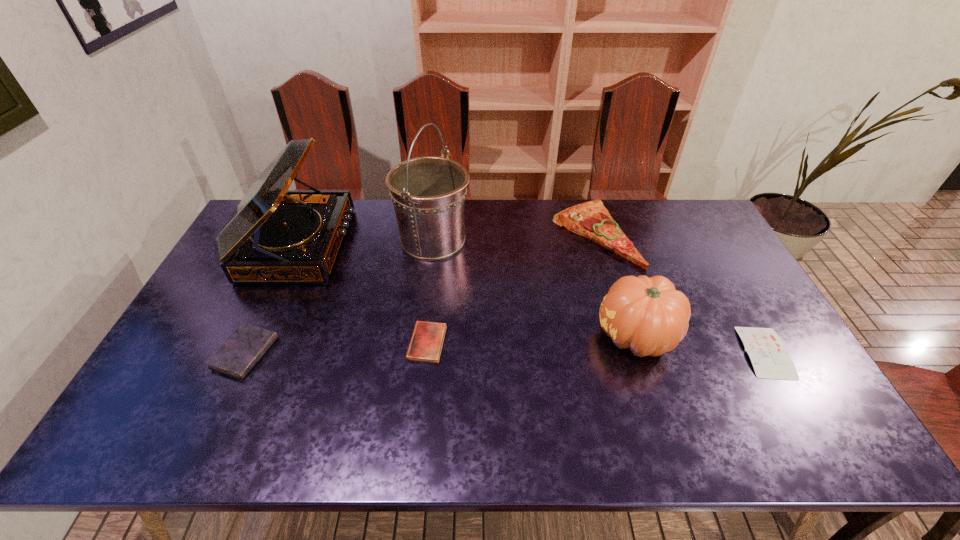
Where is `the closest diary relative to the leftmost diary`? This screenshot has height=540, width=960. the closest diary relative to the leftmost diary is located at coordinates (427, 339).

Locate which diary is the second closest to the shortest diary. Please provide its 2D coordinates. Your answer should be formatted as a tuple, i.e. [(x, y)], where the tuple contains the x and y coordinates of a point satisfying the conditions above.

[(241, 351)]

Locate an element on the screen. vacant space that satisfies the following two spatial constraints: 1. on the carved face of the rightmost diary; 2. on the left side of the fifth shortest object is located at coordinates (642, 352).

Locate an element on the screen. Image resolution: width=960 pixels, height=540 pixels. free region that satisfies the following two spatial constraints: 1. on the back side of the rightmost diary; 2. on the carved face of the third tallest object is located at coordinates (756, 336).

Locate an element on the screen. The image size is (960, 540). free spot that satisfies the following two spatial constraints: 1. on the carved face of the rightmost object; 2. on the right side of the third tallest object is located at coordinates (642, 352).

Where is `vacant position in the image that satisfies the following two spatial constraints: 1. on the front-facing side of the sixth shortest object; 2. on the back side of the second diary from right to left`? vacant position in the image that satisfies the following two spatial constraints: 1. on the front-facing side of the sixth shortest object; 2. on the back side of the second diary from right to left is located at coordinates (253, 343).

The height and width of the screenshot is (540, 960). Identify the location of vacant region that satisfies the following two spatial constraints: 1. on the back side of the tallest object; 2. on the left side of the leftmost diary. (298, 240).

Find the location of a particular element. The height and width of the screenshot is (540, 960). free space that satisfies the following two spatial constraints: 1. on the back side of the tallest object; 2. on the left side of the fourth shortest object is located at coordinates (434, 234).